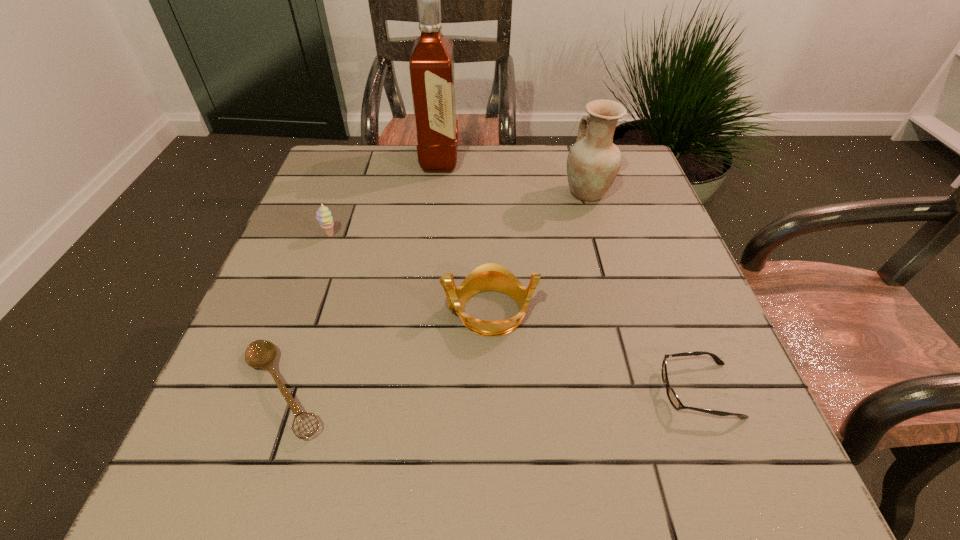
What are the coordinates of `pottery that is at the far edge` in the screenshot? It's located at (593, 162).

Image resolution: width=960 pixels, height=540 pixels. I want to click on object present at the near edge, so click(x=261, y=353).

Find the location of `sherbert that is at the left edge`. sherbert that is at the left edge is located at coordinates tap(324, 217).

Identify the location of ladle located at the left edge. (261, 353).

Identify the location of pottery present at the right edge. This screenshot has height=540, width=960. (593, 162).

At what (x,y) coordinates should I click in order to perform the action: click on spectacles at the right edge. Please return your answer as a coordinate pair (x, y). The image size is (960, 540). Looking at the image, I should click on (673, 398).

This screenshot has width=960, height=540. Identify the location of object at the near left corner. (261, 353).

This screenshot has height=540, width=960. Identify the location of object at the far right corner. (593, 162).

The width and height of the screenshot is (960, 540). I want to click on vacant space at the far edge of the desktop, so click(551, 163).

You are a GUI agent. You are given a task and a screenshot of the screen. Output one action in this format:
    pyautogui.click(x=<x>, y=<y>)
    Task: Click on the vacant position at the near edge of the desktop
    
    Given the screenshot: What is the action you would take?
    pyautogui.click(x=622, y=494)